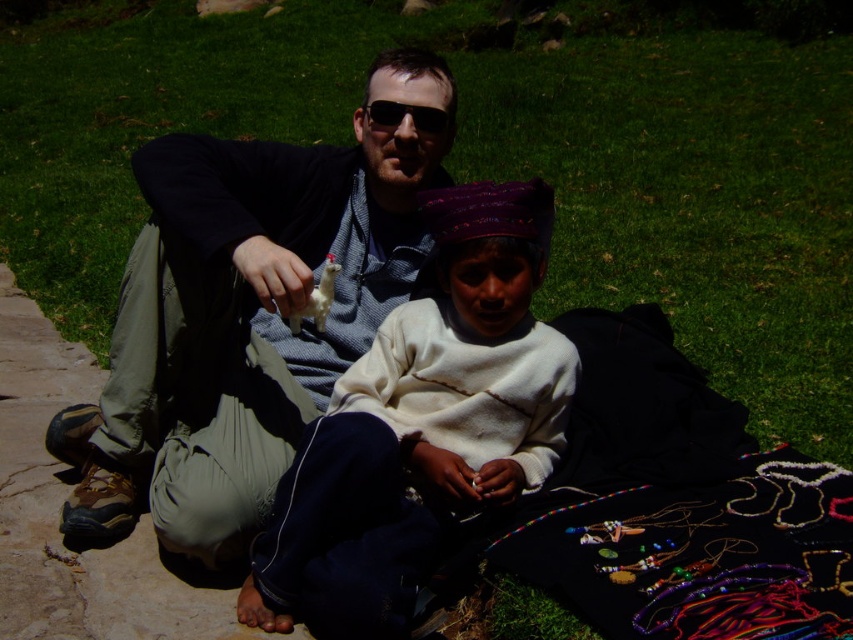
Question: Is green grass at center thinner than black plastic sunglasses at center?

Choices:
 (A) no
 (B) yes

Answer: (A)

Question: Estimate the real-world distances between objects in this image. Which object is closer to the white soft sweater at center?

Choices:
 (A) green grass at center
 (B) white plastic llama at center
 (C) matte gray sweater at center
 (D) black plastic sunglasses at center

Answer: (C)

Question: Among these objects, which one is farthest from the camera?

Choices:
 (A) black plastic sunglasses at center
 (B) green grass at center
 (C) matte gray sweater at center
 (D) white soft sweater at center

Answer: (A)

Question: Which point is closer to the camera?

Choices:
 (A) (387, 467)
 (B) (439, 112)

Answer: (A)

Question: Is green grass at center in front of white plastic llama at center?

Choices:
 (A) no
 (B) yes

Answer: (A)

Question: Does matte gray sweater at center have a smaller size compared to black plastic sunglasses at center?

Choices:
 (A) yes
 (B) no

Answer: (B)